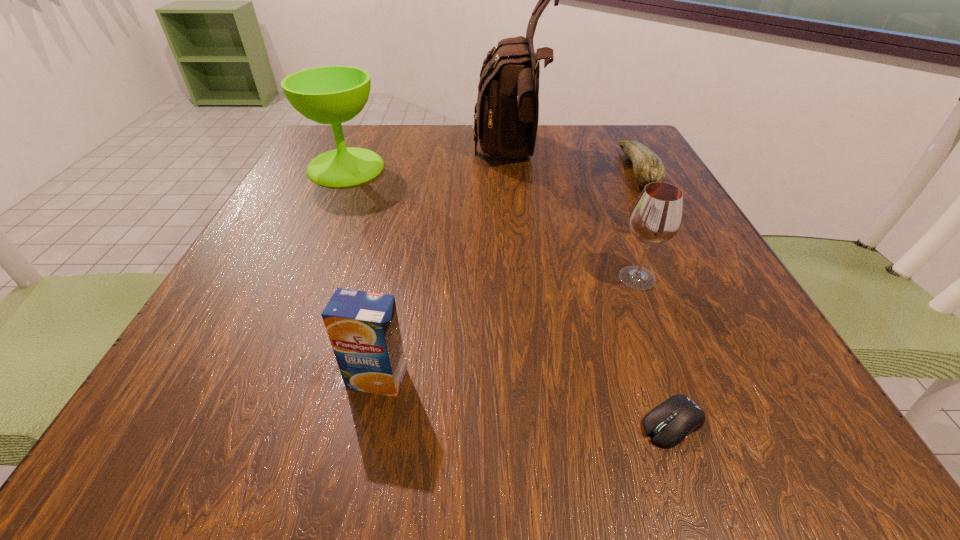
You are a GUI agent. You are given a task and a screenshot of the screen. Output one action in this format:
    pyautogui.click(x=<x>, y=<y>)
    Task: Click on the object that stands as the fourth closest to the fifth object from right to left
    This screenshot has height=540, width=960.
    Given the screenshot: What is the action you would take?
    pyautogui.click(x=333, y=95)

Where is `free space in the image that satisfies the following two spatial constraints: 1. on the front-facing side of the nearest object; 2. on the left side of the shoulder bag`? free space in the image that satisfies the following two spatial constraints: 1. on the front-facing side of the nearest object; 2. on the left side of the shoulder bag is located at coordinates [543, 423].

Where is `blank area in the image that satisfies the following two spatial constraints: 1. on the back side of the shortest object; 2. on the front-facing side of the third object from left to right`? This screenshot has width=960, height=540. blank area in the image that satisfies the following two spatial constraints: 1. on the back side of the shortest object; 2. on the front-facing side of the third object from left to right is located at coordinates (579, 157).

At what (x,y) coordinates should I click in order to perform the action: click on vacant area that satisfies the following two spatial constraints: 1. on the front-facing side of the shortest object; 2. on the left side of the fourth object from right to left. Please return your answer as a coordinate pair (x, y). The width and height of the screenshot is (960, 540). Looking at the image, I should click on (543, 423).

Locate an element on the screen. The width and height of the screenshot is (960, 540). free space that satisfies the following two spatial constraints: 1. on the front-facing side of the third object from left to right; 2. on the back side of the nearest object is located at coordinates (543, 423).

You are a GUI agent. You are given a task and a screenshot of the screen. Output one action in this format:
    pyautogui.click(x=<x>, y=<y>)
    Task: Click on the free space that satisfies the following two spatial constraints: 1. on the front-facing side of the third nearest object; 2. on the right side of the third object from left to right
    This screenshot has height=540, width=960.
    Given the screenshot: What is the action you would take?
    pyautogui.click(x=527, y=278)

Image resolution: width=960 pixels, height=540 pixels. Identify the location of free space that satisfies the following two spatial constraints: 1. on the back side of the fourth shortest object; 2. on the right side of the computer equipment. (622, 278).